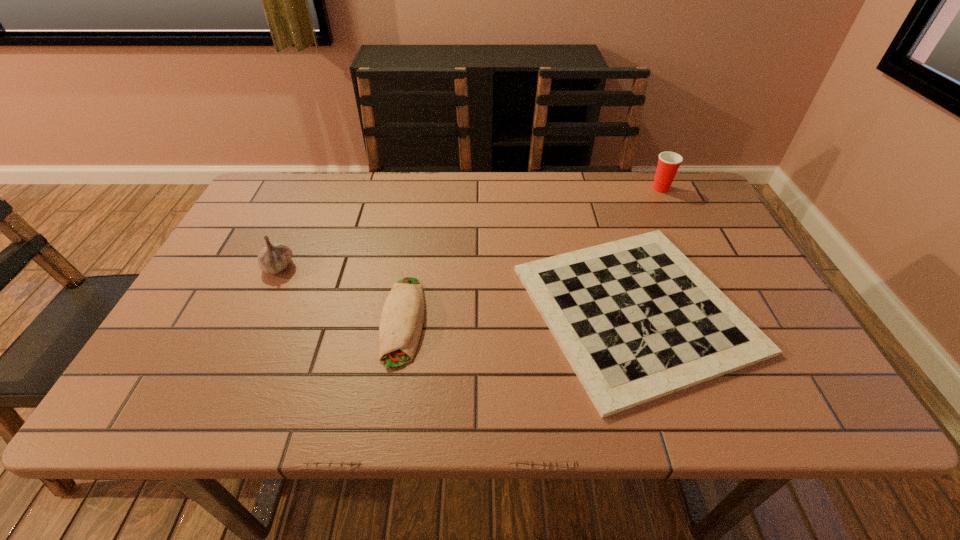
Identify the location of object located in the near edge section of the desktop. (636, 319).

You are a GUI agent. You are given a task and a screenshot of the screen. Output one action in this format:
    pyautogui.click(x=<x>, y=<y>)
    Task: Click on the object present at the left edge
    
    Given the screenshot: What is the action you would take?
    pyautogui.click(x=273, y=258)

This screenshot has height=540, width=960. Identify the location of Dixie cup at the right edge. (668, 163).

Where is `checkerboard that is at the right edge`? The height and width of the screenshot is (540, 960). checkerboard that is at the right edge is located at coordinates (636, 319).

This screenshot has height=540, width=960. Find the location of `object that is at the far right corner`. object that is at the far right corner is located at coordinates (668, 163).

Find the location of a particular element. The height and width of the screenshot is (540, 960). object located in the near right corner section of the desktop is located at coordinates (636, 319).

In the image, there is a desktop. Identify the location of vacant space at the far edge. (335, 183).

This screenshot has width=960, height=540. In the image, there is a desktop. What are the coordinates of `vacant space at the near edge` in the screenshot? It's located at (732, 399).

This screenshot has width=960, height=540. In order to click on free space at the left edge of the desktop in this screenshot , I will do `click(204, 305)`.

Find the location of a particular element. Image resolution: width=960 pixels, height=540 pixels. vacant space at the right edge of the desktop is located at coordinates (743, 298).